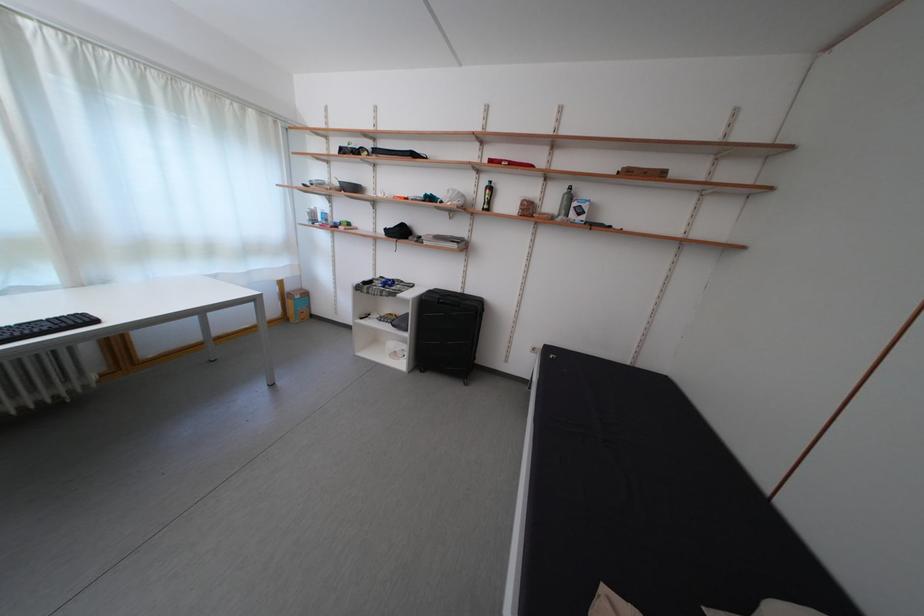
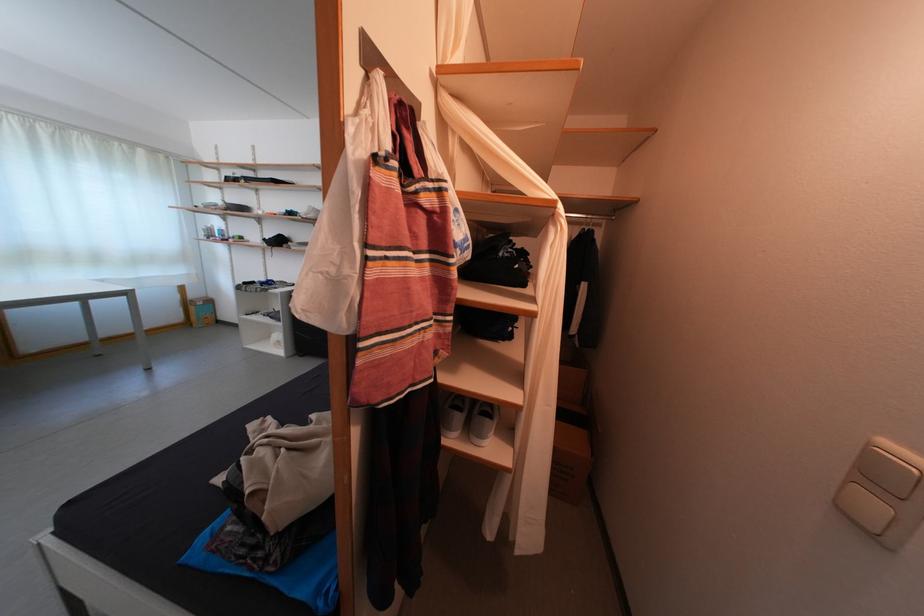
Where in the second image is the point corresponding to (298,294) from the first image?

(201, 302)